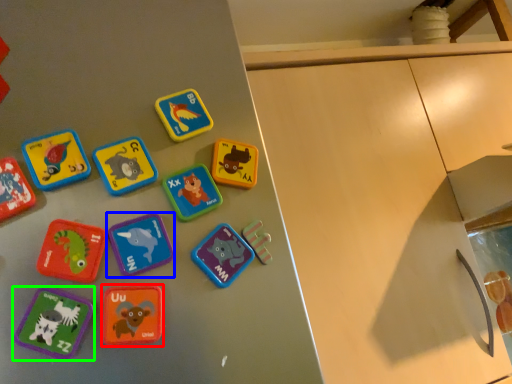
Question: Based on their relative distances, which object is farther from toy (highlighted by a red box)? Choose from toy (highlighted by a blue box) and toy (highlighted by a green box).

Choices:
 (A) toy
 (B) toy

Answer: (A)